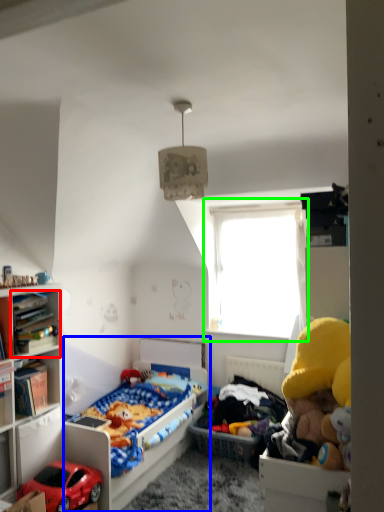
Question: Based on their relative distances, which object is nearer to cabinet (highlighted by a red box)? Choose from bed (highlighted by a blue box) and window (highlighted by a green box).

Choices:
 (A) bed
 (B) window

Answer: (A)